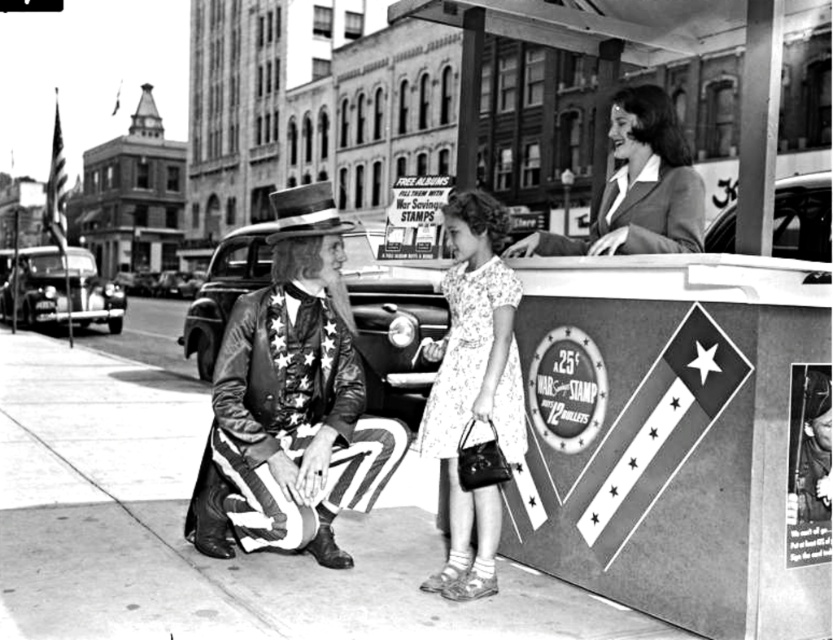
Question: Which is nearer to the smooth black suit at upper right?

Choices:
 (A) smooth concrete pavement at center
 (B) leather jacket with stars at center

Answer: (B)

Question: Is floral cotton dress at center further to the viewer compared to smooth black suit at upper right?

Choices:
 (A) no
 (B) yes

Answer: (B)

Question: Which point is closer to the camera taking this photo?

Choices:
 (A) (337, 496)
 (B) (136, 388)
 (C) (659, 186)
 (D) (497, 538)

Answer: (D)

Question: Is floral cotton dress at center to the left of smooth black suit at upper right from the viewer's perspective?

Choices:
 (A) no
 (B) yes

Answer: (B)

Question: Which object is farther from the camera taking this photo?

Choices:
 (A) smooth black suit at upper right
 (B) smooth concrete pavement at center
 (C) leather jacket with stars at center

Answer: (C)

Question: Can you confirm if smooth concrete pavement at center is positioned above leather jacket with stars at center?

Choices:
 (A) no
 (B) yes

Answer: (A)